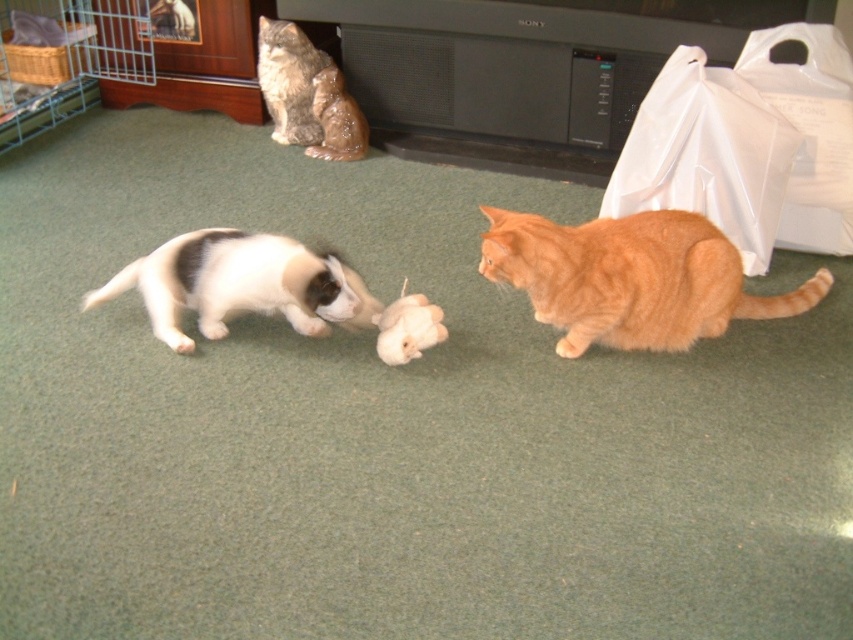
You are a cat owner who wants to place a new cat tree in the living room. The cat tree is 2 meters tall. You see the transparent plastic bag at upper right and the gray tabby cat at upper left. Which object is closer to the ceiling?

The transparent plastic bag at upper right is positioned under gray tabby cat at upper left, so the gray tabby cat at upper left is closer to the ceiling.

You are a cat owner observing the orange fur cat at center and the white fur at center. Which cat has a bigger size?

The orange fur cat at center is larger in size than the white fur at center.

Looking at this image, you are a cat owner who wants to place a small water bowl between the orange fur cat at center and the white fur at center. The bowl has a diameter of 10 inches. Will there be enough space between them to fit the bowl?

The orange fur cat at center and white fur at center are 28.37 inches apart from each other. Since the bowl requires 10 inches of space, there is sufficient room to place it between them.